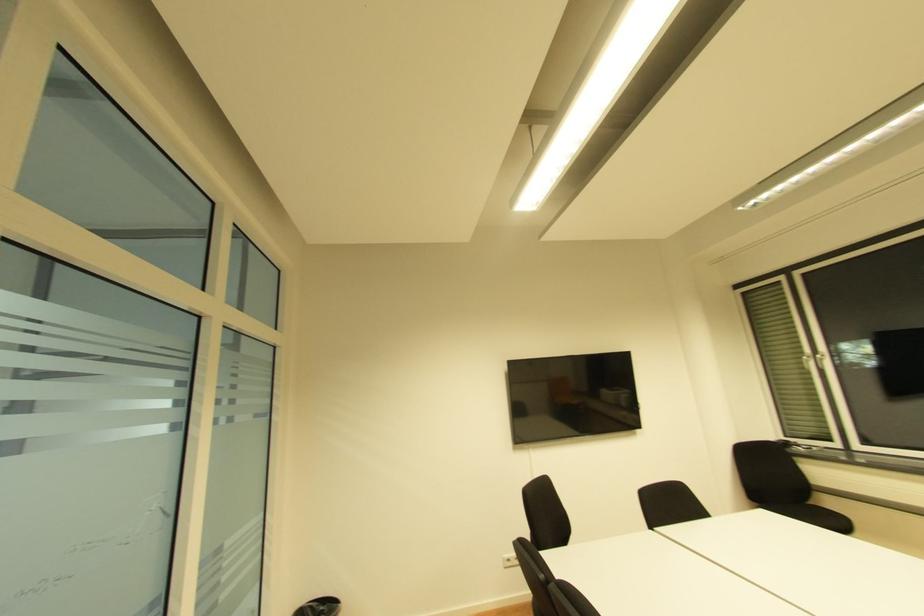
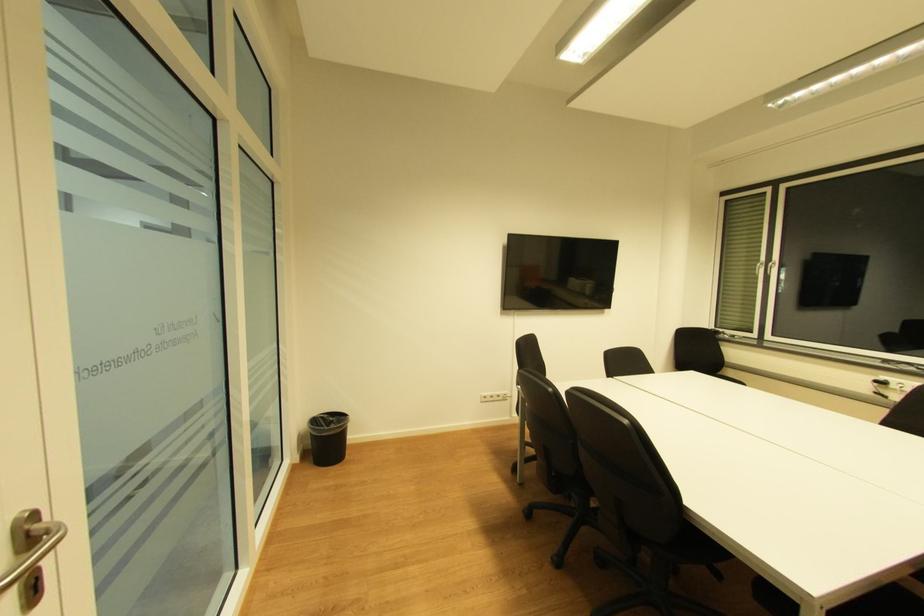
Question: How did the camera likely rotate?

Choices:
 (A) Left
 (B) Right
 (C) Up
 (D) Down

Answer: (D)